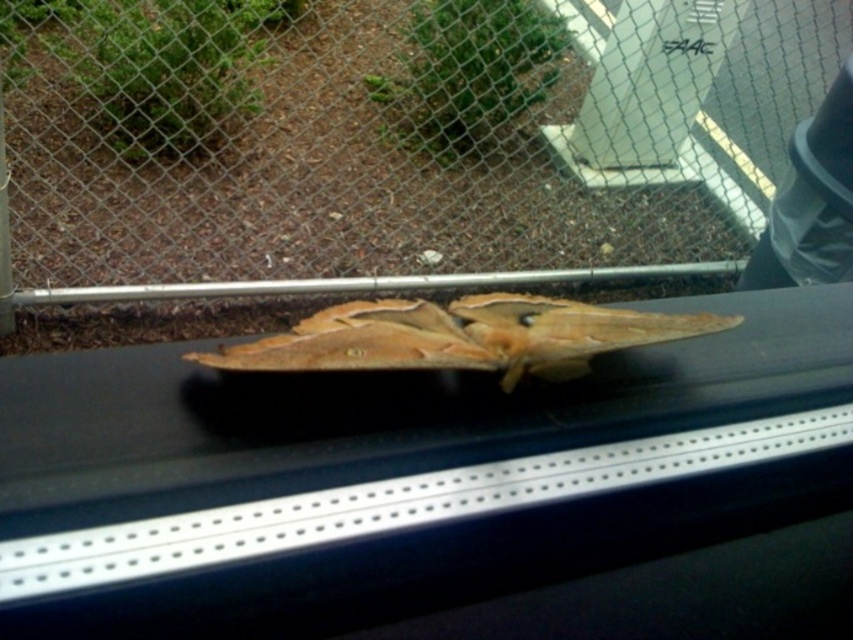
Question: Does metal chain-link fence at center appear on the left side of brown matte butterfly at center?

Choices:
 (A) yes
 (B) no

Answer: (B)

Question: Which of the following is the farthest from the observer?

Choices:
 (A) (610, 180)
 (B) (489, 304)

Answer: (A)

Question: Which point is farther to the camera?

Choices:
 (A) 561,336
 (B) 567,193

Answer: (B)

Question: Does metal chain-link fence at center have a greater width compared to brown matte butterfly at center?

Choices:
 (A) no
 (B) yes

Answer: (B)

Question: Does metal chain-link fence at center appear over brown matte butterfly at center?

Choices:
 (A) no
 (B) yes

Answer: (B)

Question: Which point is closer to the camera?

Choices:
 (A) metal chain-link fence at center
 (B) brown matte butterfly at center

Answer: (B)